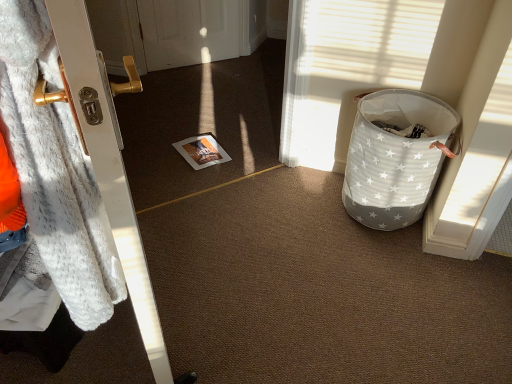
Where is `vacant area that lies to the right of white fur coat at left`? vacant area that lies to the right of white fur coat at left is located at coordinates (256, 306).